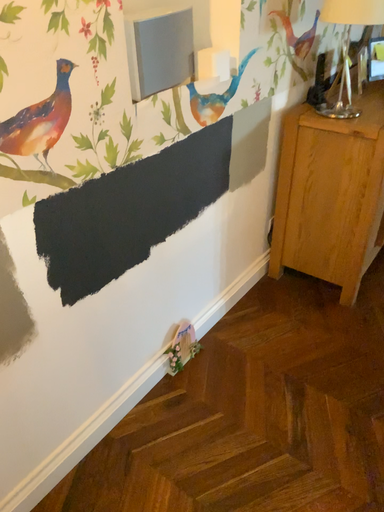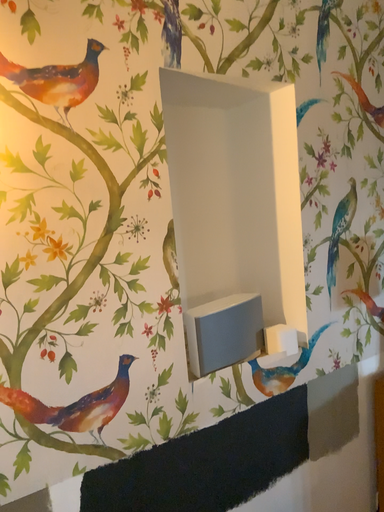
Question: How did the camera likely rotate when shooting the video?

Choices:
 (A) rotated upward
 (B) rotated downward

Answer: (A)